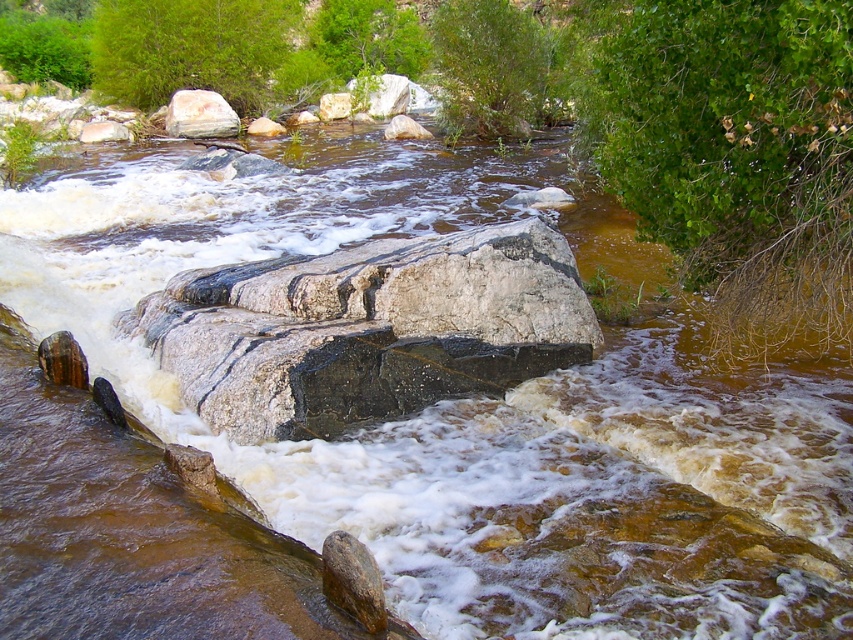
You are a hiker trying to cross the river using the smooth gray rock at center. There is a green leafy bush at upper center nearby. Which object is higher in elevation?

The smooth gray rock at center is higher in elevation than the green leafy bush at upper center because the bush is located below the rock.

You are a hiker trying to cross the river by stepping on the rocks. You have a backpack that requires at least 1.5 square feet of flat surface to place it safely. Given the white marble rock at center and the smooth gray rock at center, which rock would be more suitable for placing your backpack?

The smooth gray rock at center is larger than the white marble rock at center, so it provides a larger flat surface and is more suitable for placing the backpack safely.